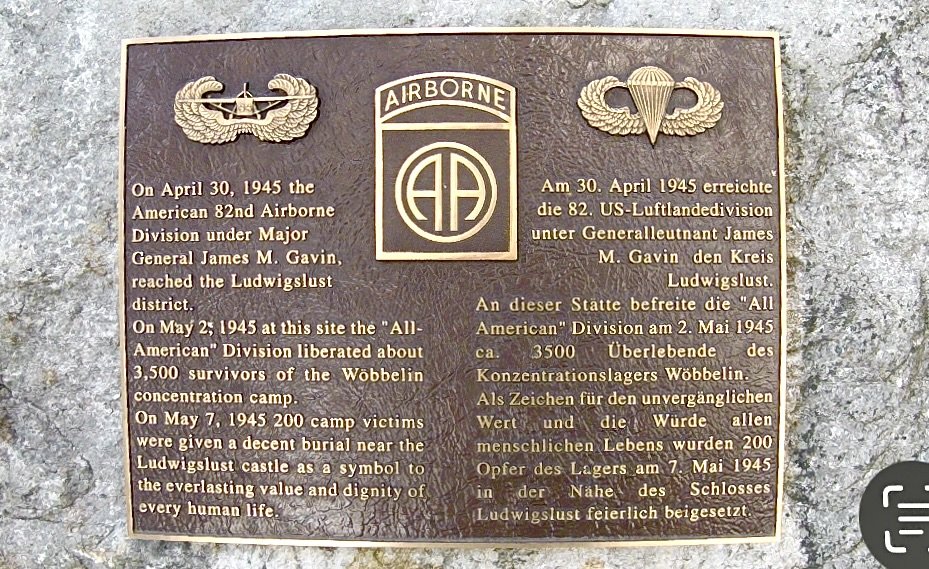
Identify the location of gold edge of plaque. The height and width of the screenshot is (569, 929). (782, 244), (445, 31), (121, 261), (464, 540).